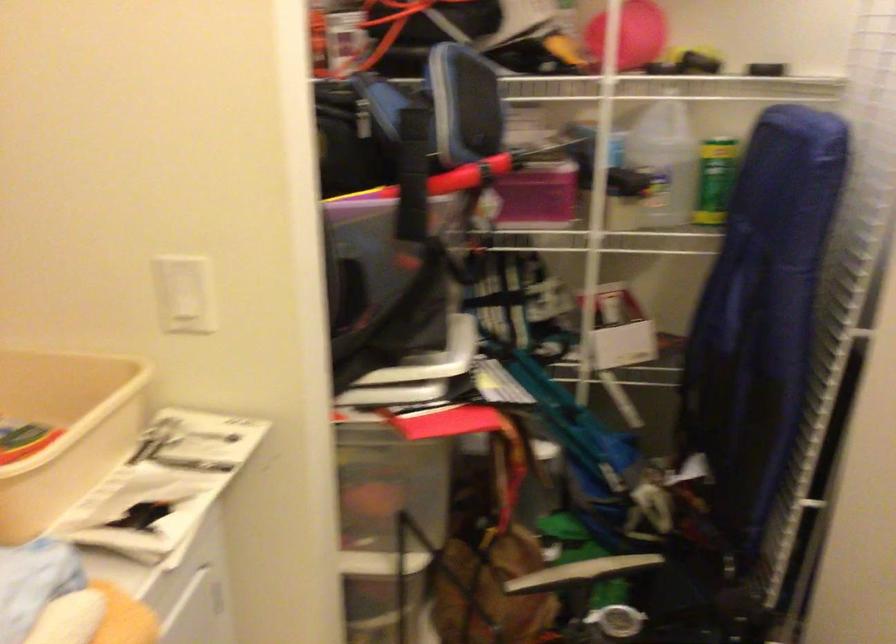
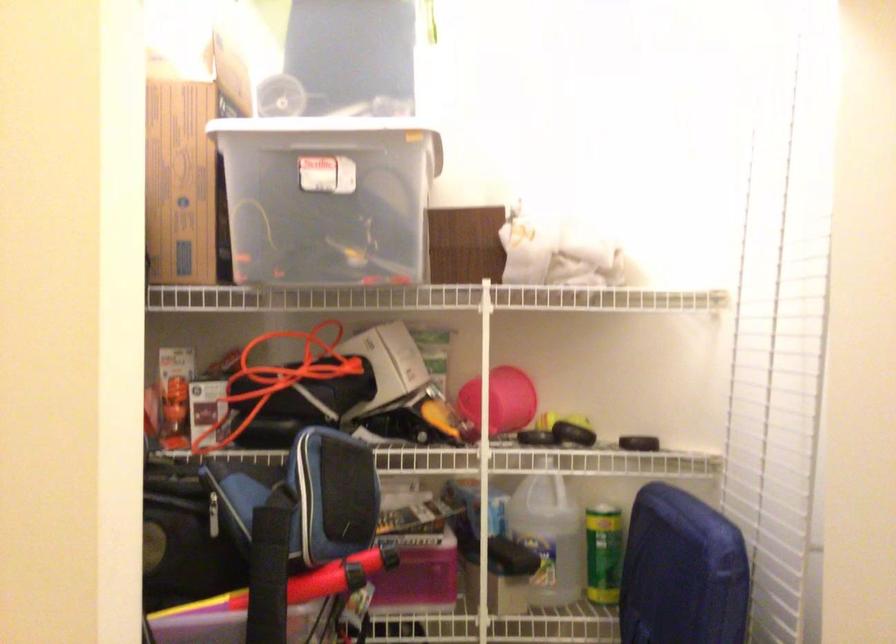
Find the pixel in the second image that matches (538,194) in the first image.

(418, 574)